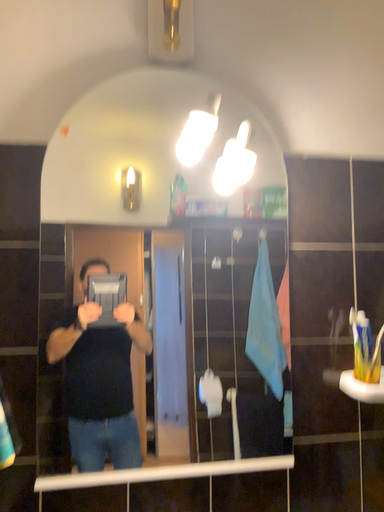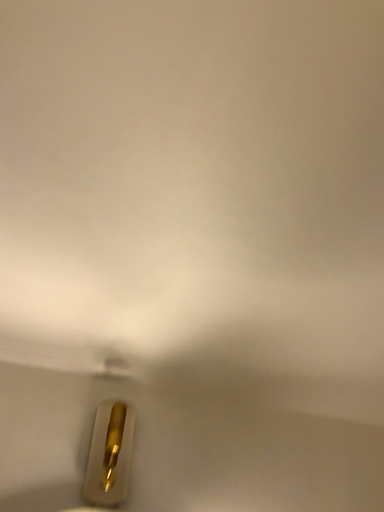
Question: How did the camera likely rotate when shooting the video?

Choices:
 (A) rotated downward
 (B) rotated upward

Answer: (B)